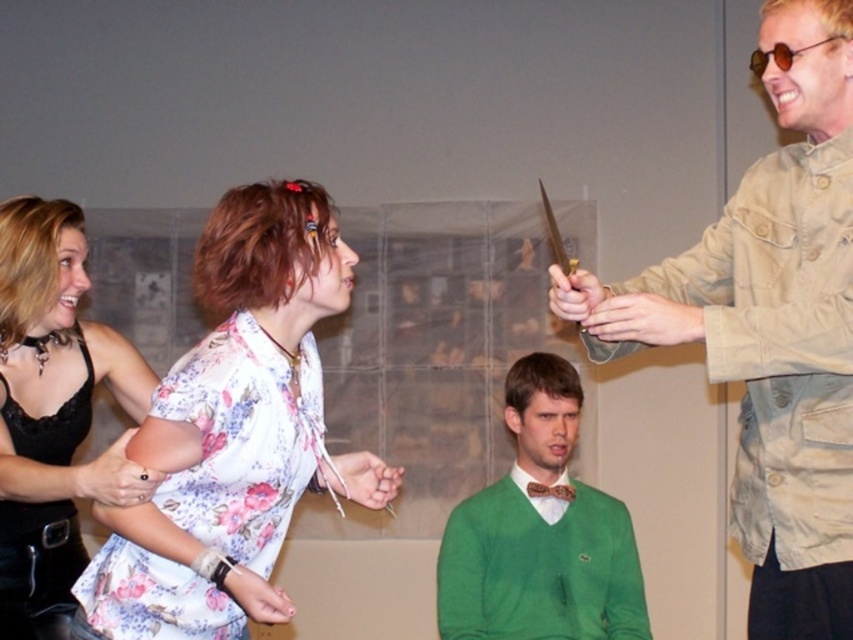
You are a fashion designer who wants to showcase both the tan canvas jacket at right and the floral fabric blouse at center in a photoshoot. Based on the scene, which item is covering part of the other?

The tan canvas jacket at right is positioned over the floral fabric blouse at center, so it is covering part of it.

You are standing in the scene and want to hand a gift to both the tan canvas jacket at right and the floral fabric blouse at center. Which one should you approach first based on their positions?

You should approach the tan canvas jacket at right first because it is closer to you than the floral fabric blouse at center.

You are a photographer setting up a shoot in this indoor scene. You need to place a small prop between the matte black leather jacket at left and the green knit sweater at center. Based on their positions, which side of the sweater should you place it on?

The matte black leather jacket at left is positioned on the left side of the green knit sweater at center, so you should place the prop to the left of the green knit sweater at center.